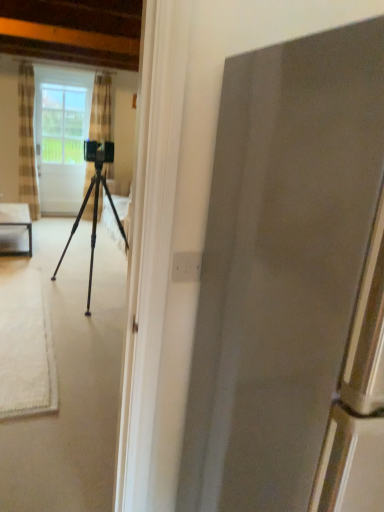
Question: Which direction should I rotate to look at striped fabric curtain at center, positioned as the second curtain in left-to-right order, — up or down?

Choices:
 (A) up
 (B) down

Answer: (A)

Question: Is metallic tripod at center positioned beyond the bounds of checkered fabric curtain at left, the second curtain from the right?

Choices:
 (A) yes
 (B) no

Answer: (A)

Question: From the image's perspective, does metallic tripod at center appear lower than checkered fabric curtain at left, the second curtain from the right?

Choices:
 (A) no
 (B) yes

Answer: (B)

Question: Does metallic tripod at center lie behind checkered fabric curtain at left, the 1th curtain positioned from the left?

Choices:
 (A) no
 (B) yes

Answer: (A)

Question: Is metallic tripod at center far from checkered fabric curtain at left, the second curtain from the right?

Choices:
 (A) no
 (B) yes

Answer: (B)

Question: Is metallic tripod at center next to checkered fabric curtain at left, the 1th curtain positioned from the left, and touching it?

Choices:
 (A) yes
 (B) no

Answer: (B)

Question: Considering the relative sizes of metallic tripod at center and checkered fabric curtain at left, the second curtain from the right, in the image provided, is metallic tripod at center thinner than checkered fabric curtain at left, the second curtain from the right,?

Choices:
 (A) yes
 (B) no

Answer: (B)

Question: Considering the relative sizes of striped fabric curtain at center, positioned as the second curtain in left-to-right order, and clear glass table at left in the image provided, is striped fabric curtain at center, positioned as the second curtain in left-to-right order, thinner than clear glass table at left?

Choices:
 (A) yes
 (B) no

Answer: (A)

Question: Does striped fabric curtain at center, positioned as the second curtain in left-to-right order, have a lesser height compared to clear glass table at left?

Choices:
 (A) yes
 (B) no

Answer: (B)

Question: Considering the relative sizes of striped fabric curtain at center, which ranks as the 1th curtain in right-to-left order, and clear glass table at left in the image provided, is striped fabric curtain at center, which ranks as the 1th curtain in right-to-left order, taller than clear glass table at left?

Choices:
 (A) no
 (B) yes

Answer: (B)

Question: From the image's perspective, is striped fabric curtain at center, positioned as the second curtain in left-to-right order, above clear glass table at left?

Choices:
 (A) no
 (B) yes

Answer: (B)

Question: From the image's perspective, is striped fabric curtain at center, which ranks as the 1th curtain in right-to-left order, below clear glass table at left?

Choices:
 (A) no
 (B) yes

Answer: (A)

Question: Considering the relative positions of striped fabric curtain at center, which ranks as the 1th curtain in right-to-left order, and clear glass table at left in the image provided, is striped fabric curtain at center, which ranks as the 1th curtain in right-to-left order, to the left of clear glass table at left from the viewer's perspective?

Choices:
 (A) no
 (B) yes

Answer: (A)

Question: Is clear glass screen door at upper left bigger than striped fabric curtain at center, positioned as the second curtain in left-to-right order?

Choices:
 (A) yes
 (B) no

Answer: (B)